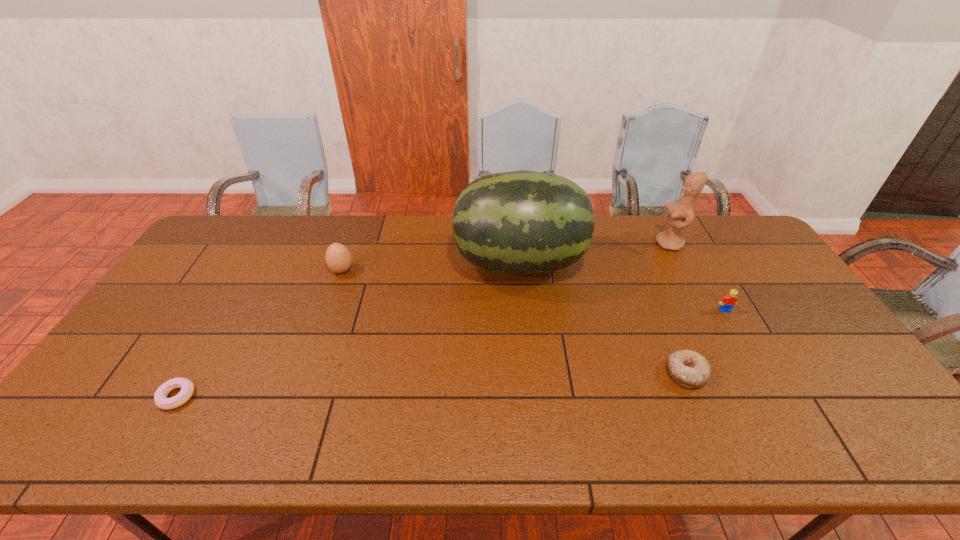
In the image, there is a desktop. Identify the location of free space at the far edge. (439, 235).

This screenshot has height=540, width=960. Find the location of `vacant space at the near edge`. vacant space at the near edge is located at coordinates (177, 439).

Locate an element on the screen. The height and width of the screenshot is (540, 960). vacant space at the left edge is located at coordinates (108, 373).

Where is `vacant space at the right edge of the desktop`? The height and width of the screenshot is (540, 960). vacant space at the right edge of the desktop is located at coordinates (764, 266).

The height and width of the screenshot is (540, 960). Find the location of `vacant space in between the watermelon and the figurine`. vacant space in between the watermelon and the figurine is located at coordinates (594, 253).

You are a GUI agent. You are given a task and a screenshot of the screen. Output one action in this format:
    pyautogui.click(x=<x>, y=<y>)
    Task: Click on the vacant area between the taller doughnut and the fifth shortest object
    This screenshot has width=960, height=540.
    Given the screenshot: What is the action you would take?
    pyautogui.click(x=678, y=308)

You are a GUI agent. You are given a task and a screenshot of the screen. Output one action in this format:
    pyautogui.click(x=<x>, y=<y>)
    Task: Click on the free spot between the fifth object from right to left and the watermelon
    This screenshot has height=540, width=960.
    Given the screenshot: What is the action you would take?
    pyautogui.click(x=430, y=267)

The width and height of the screenshot is (960, 540). In order to click on unoccupied area between the watermelon and the Lego in this screenshot , I will do `click(622, 287)`.

Identify the location of free point between the fourth tallest object and the second tallest object. (697, 277).

The image size is (960, 540). I want to click on vacant space in between the figurine and the Lego, so click(697, 277).